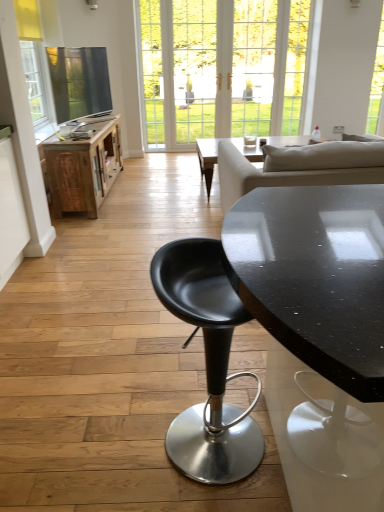
Question: Relative to wooden cabinet at left, is black matte stool at center in front or behind?

Choices:
 (A) front
 (B) behind

Answer: (A)

Question: From the image's perspective, is black matte stool at center above or below wooden cabinet at left?

Choices:
 (A) above
 (B) below

Answer: (B)

Question: Looking at their shapes, would you say black matte stool at center is wider or thinner than wooden cabinet at left?

Choices:
 (A) wide
 (B) thin

Answer: (B)

Question: Is wooden cabinet at left taller or shorter than black matte stool at center?

Choices:
 (A) short
 (B) tall

Answer: (A)

Question: Do you think wooden cabinet at left is within black matte stool at center, or outside of it?

Choices:
 (A) outside
 (B) inside

Answer: (A)

Question: From the image's perspective, is wooden cabinet at left above or below black matte stool at center?

Choices:
 (A) below
 (B) above

Answer: (B)

Question: From a real-world perspective, is wooden cabinet at left above or below black matte stool at center?

Choices:
 (A) above
 (B) below

Answer: (B)